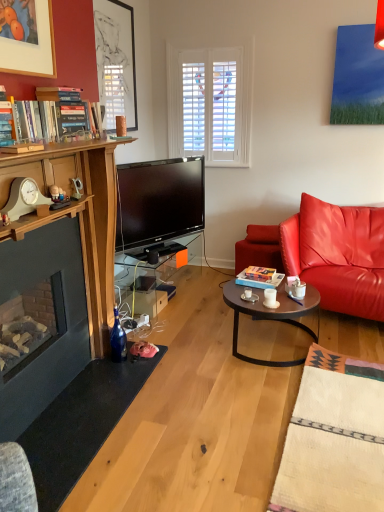
The height and width of the screenshot is (512, 384). I want to click on free space behind white ceramic mug at center, so click(x=276, y=291).